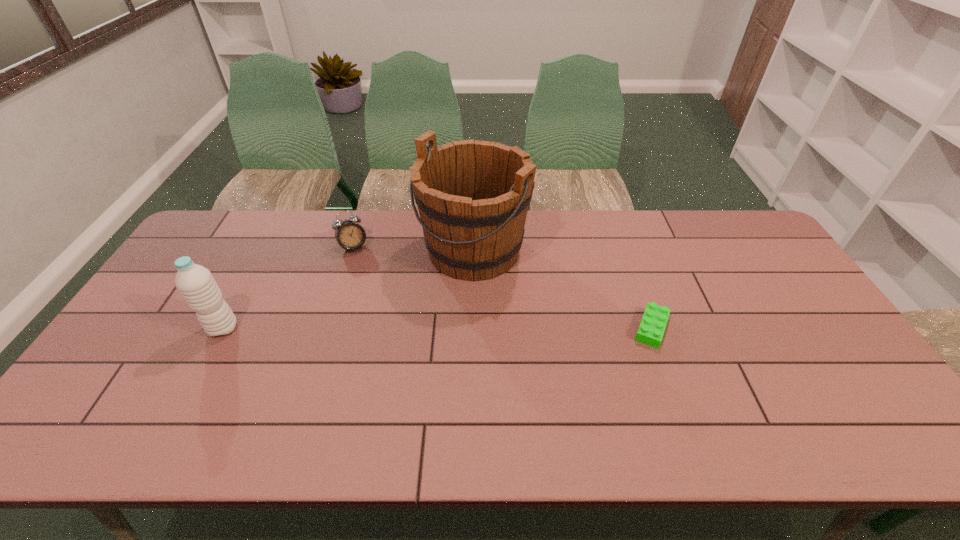
The height and width of the screenshot is (540, 960). Identify the location of water bottle. (196, 284).

Identify the location of the third shortest object. (196, 284).

In order to click on the rightmost object in this screenshot , I will do `click(650, 332)`.

Image resolution: width=960 pixels, height=540 pixels. Find the location of `Lego`. Lego is located at coordinates (650, 332).

Locate an element on the screen. the third tallest object is located at coordinates coord(350,235).

Identify the location of alarm clock. (350, 235).

Locate an element on the screen. This screenshot has height=540, width=960. the third object from left to right is located at coordinates (473, 196).

You are a GUI agent. You are given a task and a screenshot of the screen. Output one action in this format:
    pyautogui.click(x=<x>, y=<y>)
    Task: Click on the wine bucket
    This screenshot has height=540, width=960.
    Given the screenshot: What is the action you would take?
    click(473, 196)

The width and height of the screenshot is (960, 540). Find the location of `free location located 0.090m on the front of the water bottle`. free location located 0.090m on the front of the water bottle is located at coordinates (202, 368).

Locate an element on the screen. This screenshot has width=960, height=540. vacant position located 0.260m on the back of the Lego is located at coordinates (623, 251).